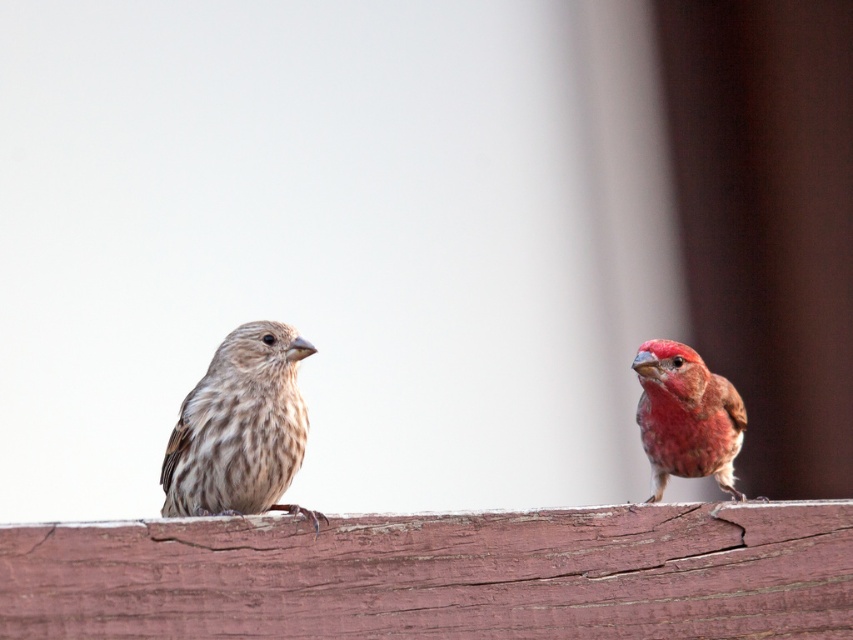
Question: Which point is closer to the camera?

Choices:
 (A) wooden plank at center
 (B) matte pink bird at right

Answer: (A)

Question: Based on their relative distances, which object is nearer to the wooden plank at center?

Choices:
 (A) matte pink bird at right
 (B) brown speckled sparrow at left

Answer: (B)

Question: Is brown speckled sparrow at left smaller than matte pink bird at right?

Choices:
 (A) yes
 (B) no

Answer: (B)

Question: Does wooden plank at center appear under matte pink bird at right?

Choices:
 (A) no
 (B) yes

Answer: (B)

Question: Estimate the real-world distances between objects in this image. Which object is closer to the wooden plank at center?

Choices:
 (A) matte pink bird at right
 (B) brown speckled sparrow at left

Answer: (B)

Question: Is wooden plank at center wider than matte pink bird at right?

Choices:
 (A) yes
 (B) no

Answer: (A)